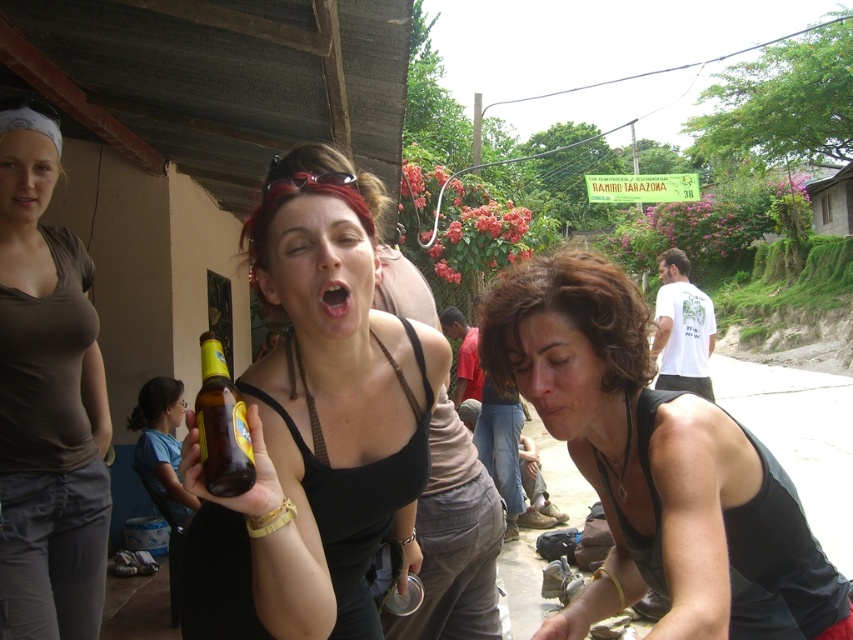
Question: Which point is farther to the camera?

Choices:
 (A) pink glossy lips at center
 (B) black matte tank top at lower right
 (C) dark brown hair at center
 (D) matte skin mouth at center

Answer: (D)

Question: Which of the following is the closest to the observer?

Choices:
 (A) click(x=344, y=307)
 (B) click(x=267, y=273)
 (C) click(x=515, y=317)
 (D) click(x=659, y=401)

Answer: (A)

Question: Estimate the real-world distances between objects in this image. Which object is farther from the matte brown bottle at center?

Choices:
 (A) dark brown hair at center
 (B) pink glossy lips at center
 (C) black matte tank top at lower right
 (D) translucent glass bottle at center

Answer: (B)

Question: Is black matte tank top at lower right wider than translucent glass bottle at center?

Choices:
 (A) yes
 (B) no

Answer: (A)

Question: Can you confirm if black matte tank top at lower right is thinner than matte brown tank top at center?

Choices:
 (A) no
 (B) yes

Answer: (A)

Question: Can you confirm if translucent glass bottle at center is bigger than matte skin mouth at center?

Choices:
 (A) yes
 (B) no

Answer: (A)